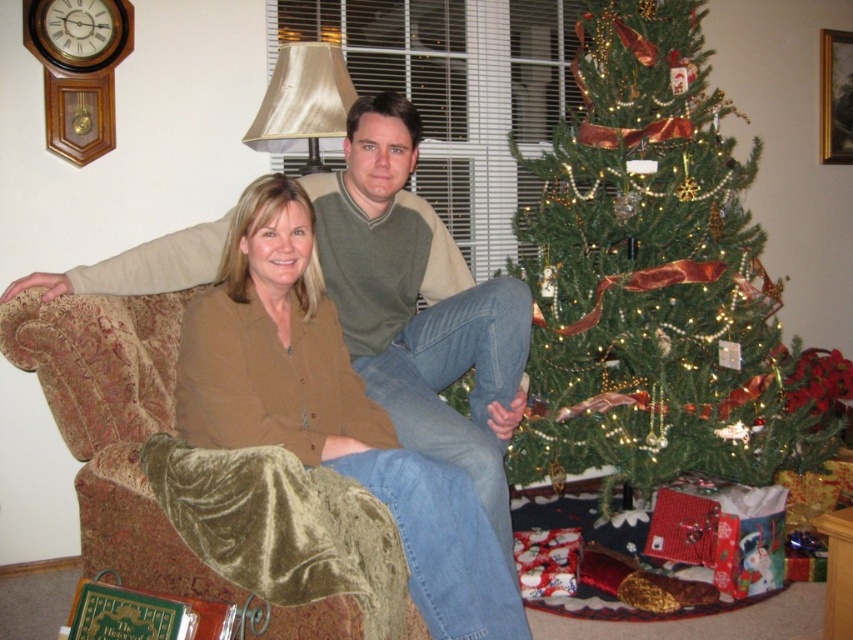
From the picture: Is green textured christmas tree at center positioned at the back of matte brown shirt at center?

Yes, it is.

Is point (619, 209) farther from viewer compared to point (415, 580)?

Yes, point (619, 209) is behind point (415, 580).

At what (x,y) coordinates should I click in order to perform the action: click on green textured christmas tree at center. Please return your answer as a coordinate pair (x, y). The image size is (853, 640). Looking at the image, I should click on (653, 276).